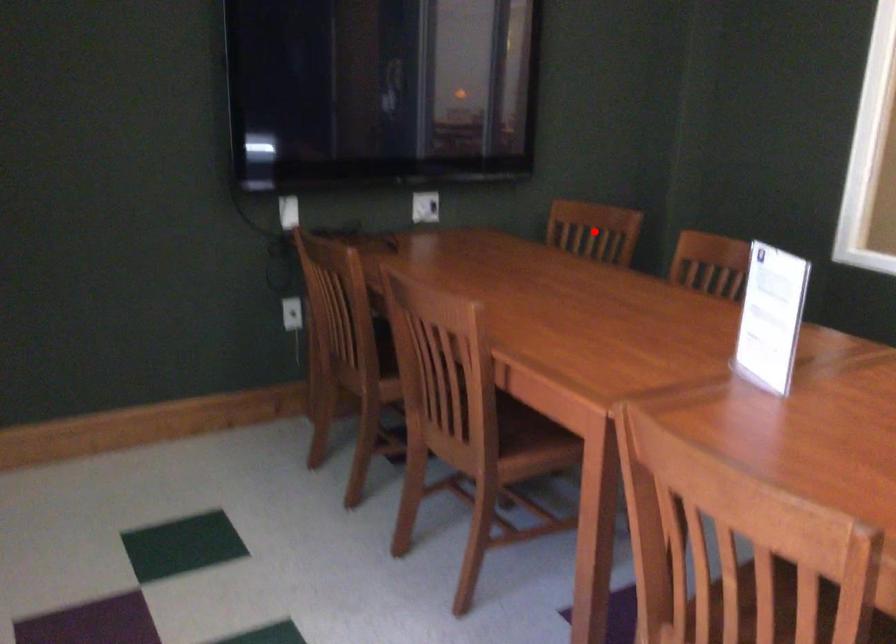
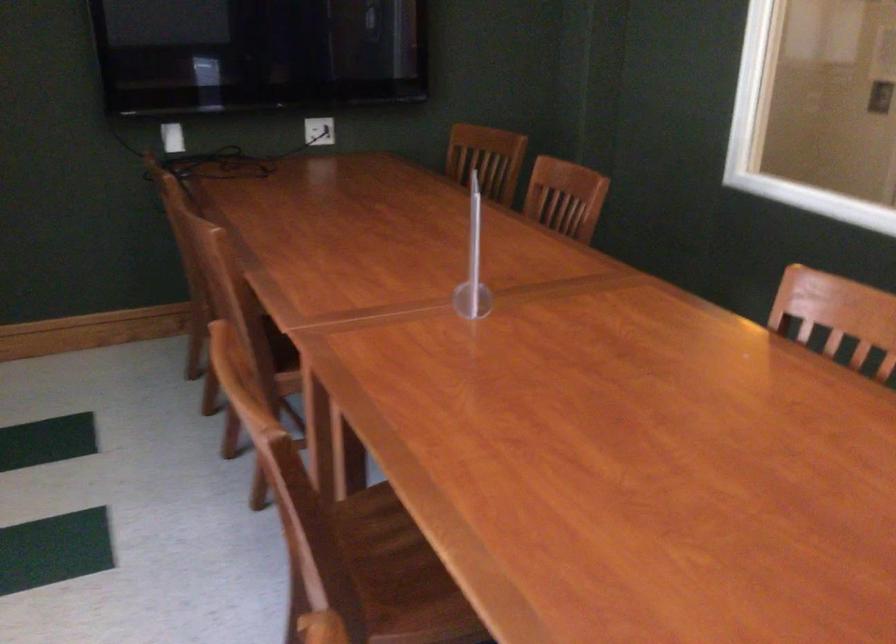
In the second image, find the point that corresponds to the highlighted location in the first image.

(487, 158)